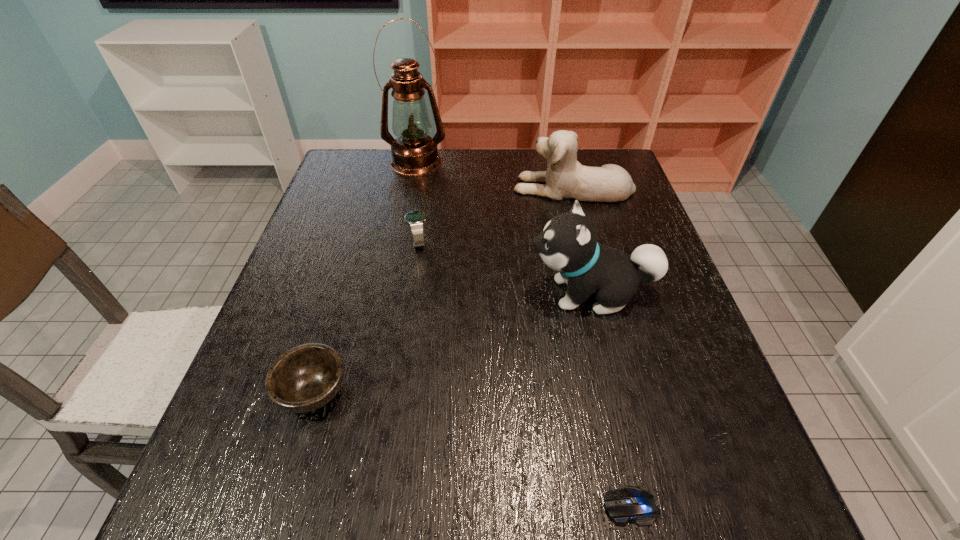
Locate an element on the screen. the nearest object is located at coordinates (631, 503).

The width and height of the screenshot is (960, 540). Identify the location of free space located 0.120m on the left of the tallest object. (348, 162).

At what (x,y) coordinates should I click in order to perform the action: click on vacant space located 0.340m at the face of the taller puppy. Please return your answer as a coordinate pair (x, y). This screenshot has height=540, width=960. Looking at the image, I should click on (377, 293).

Identify the location of vacant region located at the face of the taller puppy. Image resolution: width=960 pixels, height=540 pixels. [355, 293].

Locate an element on the screen. The height and width of the screenshot is (540, 960). free space located 0.330m at the face of the taller puppy is located at coordinates [x=382, y=293].

Where is `vacant space located on the front-facing side of the farther puppy`? The width and height of the screenshot is (960, 540). vacant space located on the front-facing side of the farther puppy is located at coordinates (486, 187).

Where is `blank space located 0.070m on the front-facing side of the farther puppy`? This screenshot has height=540, width=960. blank space located 0.070m on the front-facing side of the farther puppy is located at coordinates (490, 187).

At what (x,y) coordinates should I click in order to perform the action: click on vacant space positioned on the front-facing side of the farther puppy. Please return your answer as a coordinate pair (x, y). The image size is (960, 540). Looking at the image, I should click on (405, 187).

Find the location of a particular element. free space located on the front of the watch is located at coordinates (413, 280).

This screenshot has height=540, width=960. I want to click on vacant point located 0.060m on the right of the second shortest object, so (381, 392).